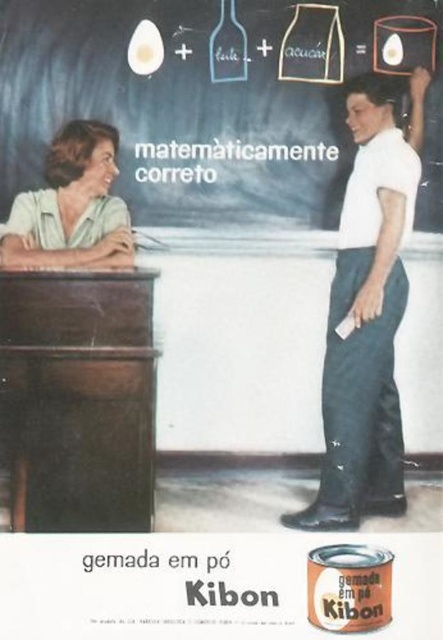
In the scene shown: Can you confirm if white smooth shirt at center is bigger than matte green blouse at upper left?

Correct, white smooth shirt at center is larger in size than matte green blouse at upper left.

Measure the distance between white smooth shirt at center and camera.

white smooth shirt at center is 1.68 meters away from camera.

What do you see at coordinates (368, 316) in the screenshot?
I see `white smooth shirt at center` at bounding box center [368, 316].

This screenshot has height=640, width=443. I want to click on white smooth shirt at center, so click(368, 316).

Is matte green blouse at upper left wider than matte glass bottle at upper center?

Indeed, matte green blouse at upper left has a greater width compared to matte glass bottle at upper center.

Is matte green blouse at upper left to the left of matte glass bottle at upper center from the viewer's perspective?

Yes, matte green blouse at upper left is to the left of matte glass bottle at upper center.

Who is more forward, (113, 152) or (210, 49)?

Point (210, 49) is more forward.

This screenshot has height=640, width=443. Identify the location of matte green blouse at upper left. (72, 205).

Can you confirm if chalkboard at upper center is positioned to the left of white smooth shirt at center?

Correct, you'll find chalkboard at upper center to the left of white smooth shirt at center.

Is point (201, 33) less distant than point (350, 259)?

Yes, it is.

Where is `chalkboard at upper center`? chalkboard at upper center is located at coordinates (214, 106).